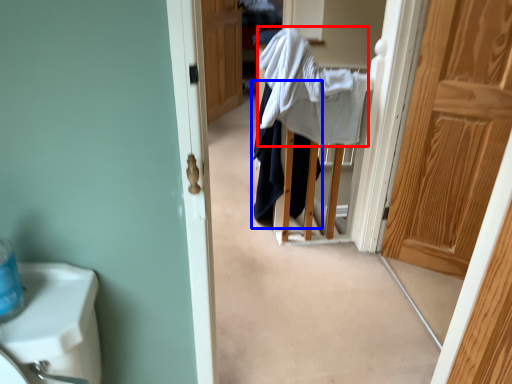
Question: Which of the following is the closest to the observer, bath towel (highlighted by a red box) or clothing (highlighted by a blue box)?

Choices:
 (A) bath towel
 (B) clothing

Answer: (A)